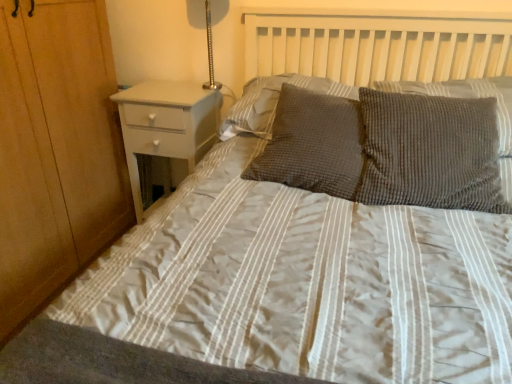
Question: Does metallic silver lamp at upper right lie behind white glossy nightstand at left?

Choices:
 (A) yes
 (B) no

Answer: (B)

Question: Is metallic silver lamp at upper right positioned in front of white glossy nightstand at left?

Choices:
 (A) yes
 (B) no

Answer: (A)

Question: Can you confirm if metallic silver lamp at upper right is positioned to the left of white glossy nightstand at left?

Choices:
 (A) no
 (B) yes

Answer: (A)

Question: Is white glossy nightstand at left located within metallic silver lamp at upper right?

Choices:
 (A) yes
 (B) no

Answer: (B)

Question: Considering the relative sizes of metallic silver lamp at upper right and white glossy nightstand at left in the image provided, is metallic silver lamp at upper right bigger than white glossy nightstand at left?

Choices:
 (A) no
 (B) yes

Answer: (A)

Question: Are metallic silver lamp at upper right and white glossy nightstand at left beside each other?

Choices:
 (A) no
 (B) yes

Answer: (A)

Question: Does white glossy nightstand at left have a lesser height compared to metallic silver lamp at upper right?

Choices:
 (A) yes
 (B) no

Answer: (B)

Question: Is white glossy nightstand at left positioned behind metallic silver lamp at upper right?

Choices:
 (A) no
 (B) yes

Answer: (B)

Question: Does white glossy nightstand at left have a greater height compared to metallic silver lamp at upper right?

Choices:
 (A) no
 (B) yes

Answer: (B)

Question: Is white glossy nightstand at left facing towards metallic silver lamp at upper right?

Choices:
 (A) no
 (B) yes

Answer: (A)

Question: Considering the relative sizes of white glossy nightstand at left and metallic silver lamp at upper right in the image provided, is white glossy nightstand at left bigger than metallic silver lamp at upper right?

Choices:
 (A) no
 (B) yes

Answer: (B)

Question: Is white glossy nightstand at left smaller than metallic silver lamp at upper right?

Choices:
 (A) no
 (B) yes

Answer: (A)

Question: Is textured gray pillow at center, acting as the 3th pillow starting from the left, smaller than textured gray pillow at center, arranged as the 4th pillow when viewed from the right?

Choices:
 (A) yes
 (B) no

Answer: (B)